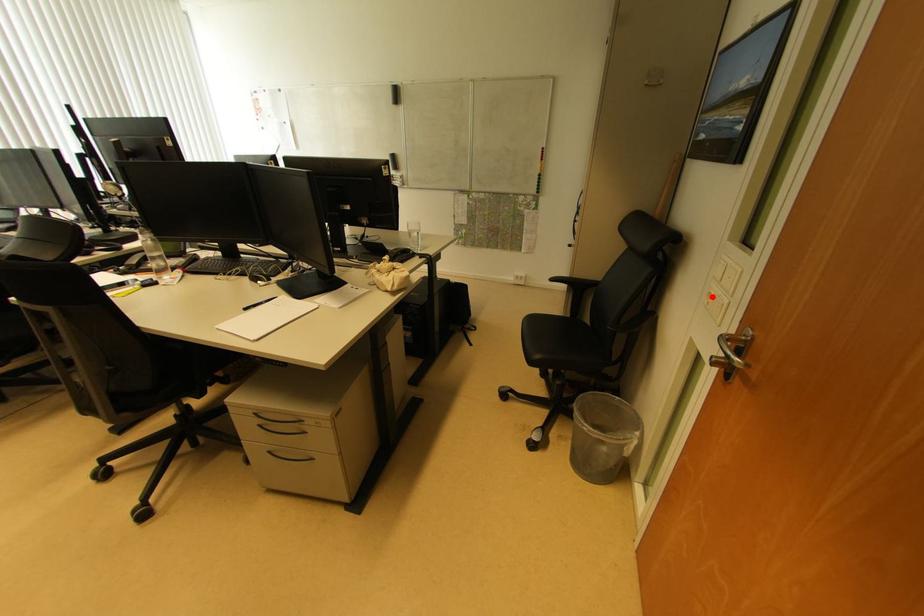
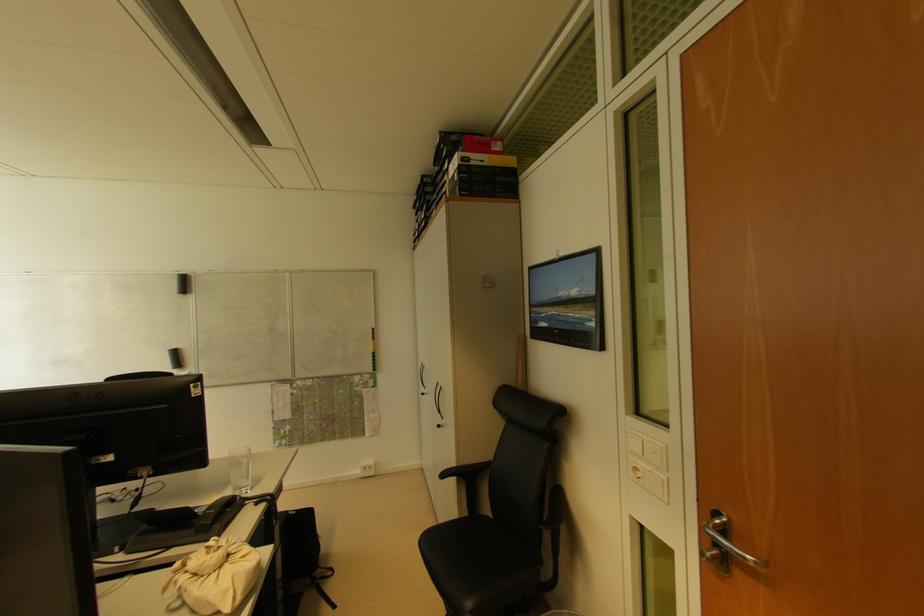
The point at the highlighted location is marked in the first image. Where is the corresponding point in the second image?

(638, 471)